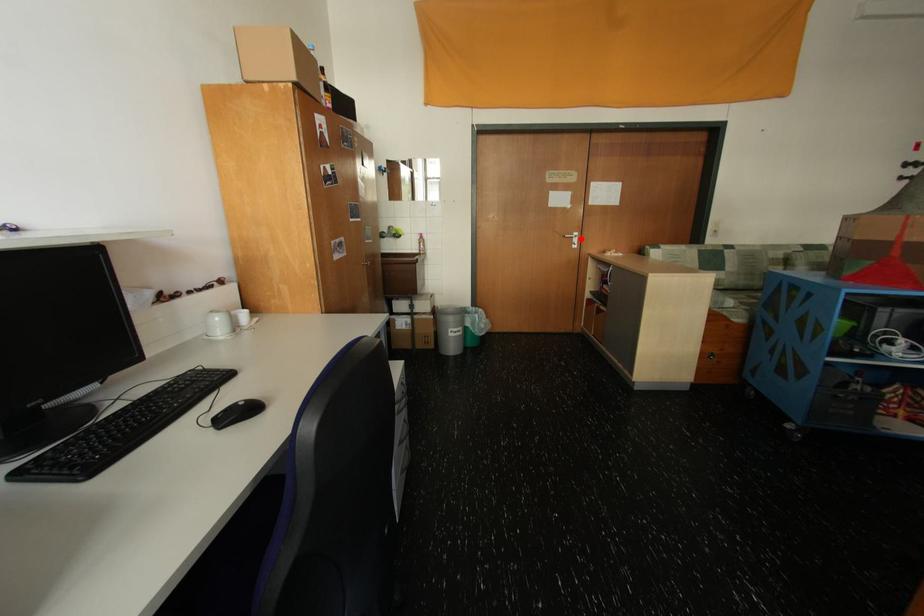
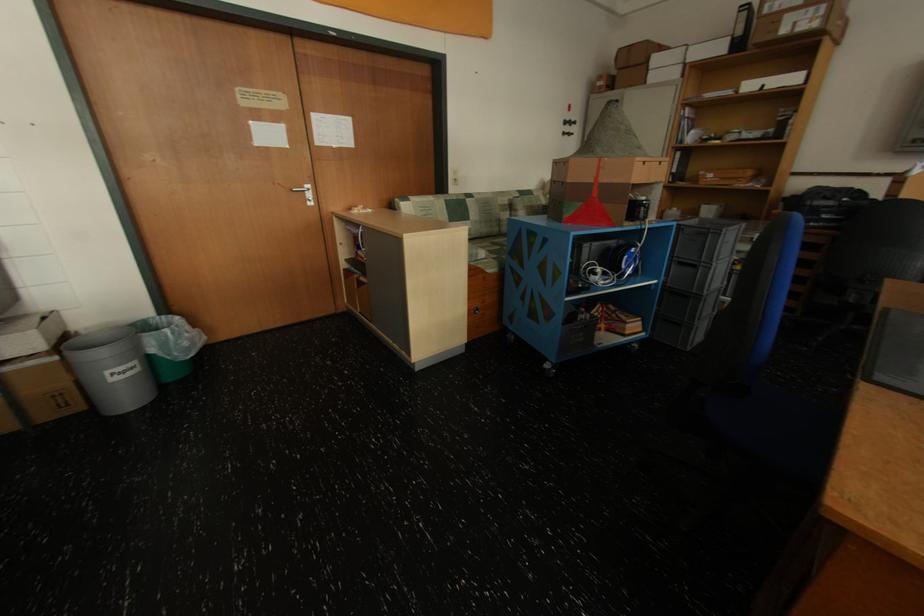
Find the pixel in the second image that matches the highlighted location in the first image.

(312, 192)